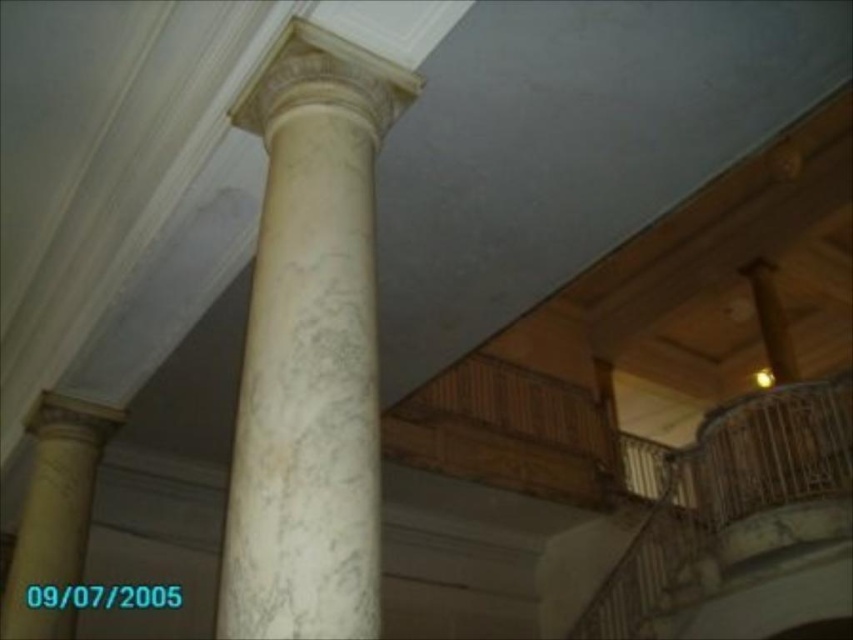
How distant is white marble column at center from white marble column at left?

white marble column at center and white marble column at left are 10.50 feet apart.

Find the location of a particular element. The height and width of the screenshot is (640, 853). white marble column at center is located at coordinates pyautogui.click(x=310, y=348).